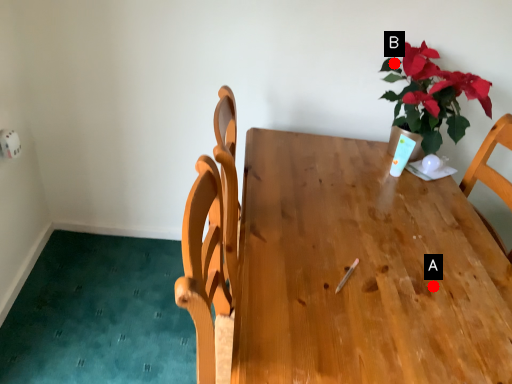
Question: Two points are circled on the image, labeled by A and B beside each circle. Which point is farther from the camera taking this photo?

Choices:
 (A) A is further
 (B) B is further

Answer: (B)